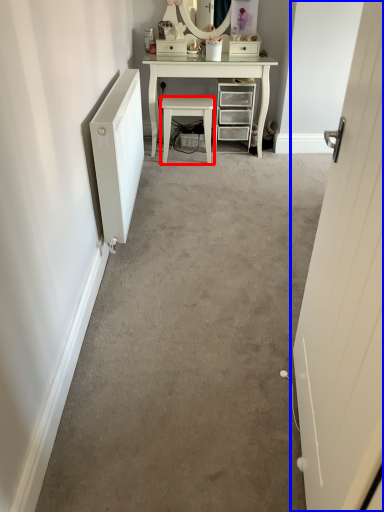
Question: Among these objects, which one is nearest to the camera, stool (highlighted by a red box) or door (highlighted by a blue box)?

Choices:
 (A) stool
 (B) door

Answer: (B)